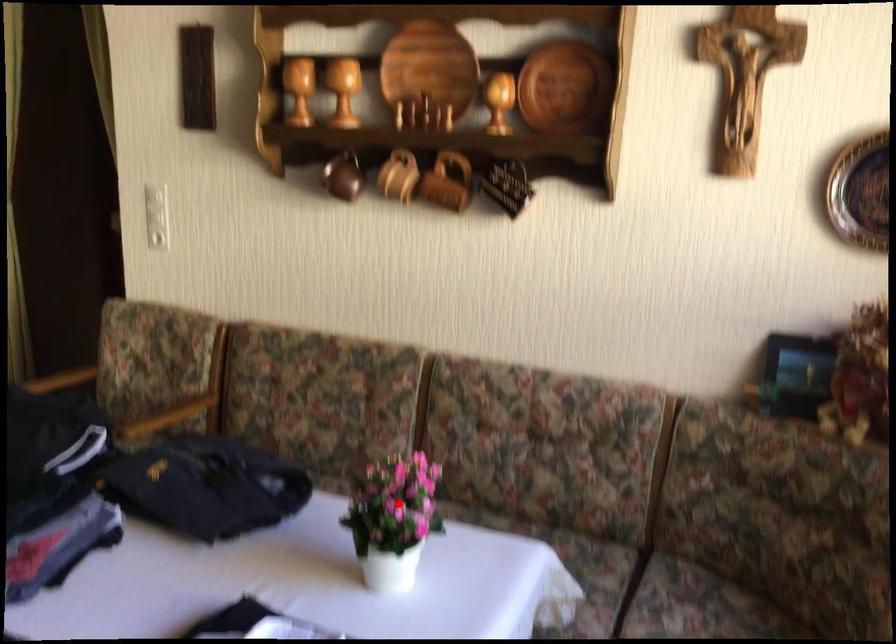
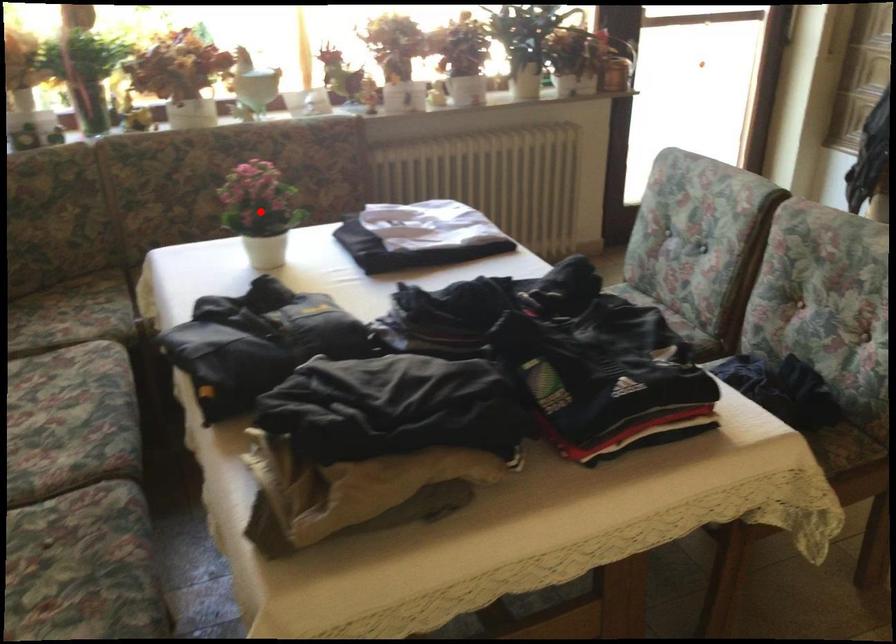
I am providing you with two images of the same scene from different viewpoints. A red point is marked on the first image and another point is marked on the second image. Are the points marked in image1 and image2 representing the same 3D position?

Yes